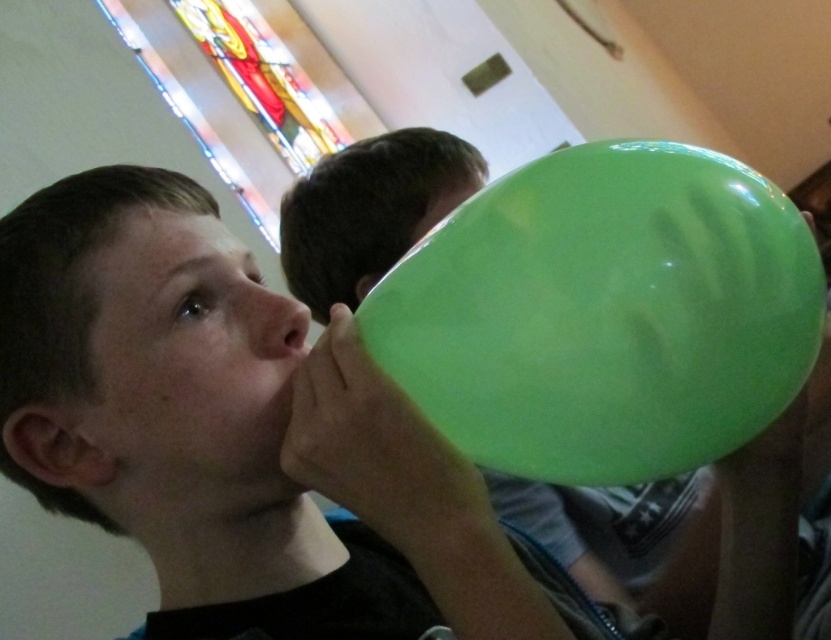
Which is more to the left, matte green balloon at upper right or green rubber balloon at center?

Positioned to the left is matte green balloon at upper right.

How distant is matte green balloon at upper right from green rubber balloon at center?

5.97 inches

Is point (321, 368) behind point (558, 324)?

That is True.

Where is `matte green balloon at upper right`? The width and height of the screenshot is (831, 640). matte green balloon at upper right is located at coordinates (232, 428).

Find the location of a particular element. This screenshot has width=831, height=640. matte green balloon at upper right is located at coordinates (232, 428).

Can you confirm if matte green balloon at upper right is taller than smooth skin face at center?

Yes.

Is point (235, 561) positioned before point (199, 307)?

No.

Locate an element on the screen. This screenshot has height=640, width=831. matte green balloon at upper right is located at coordinates (232, 428).

Which is in front, point (548, 310) or point (179, 280)?

Positioned in front is point (548, 310).

Does green rubber balloon at center have a greater width compared to smooth skin face at center?

Indeed, green rubber balloon at center has a greater width compared to smooth skin face at center.

Where is `green rubber balloon at center`? This screenshot has height=640, width=831. green rubber balloon at center is located at coordinates (605, 314).